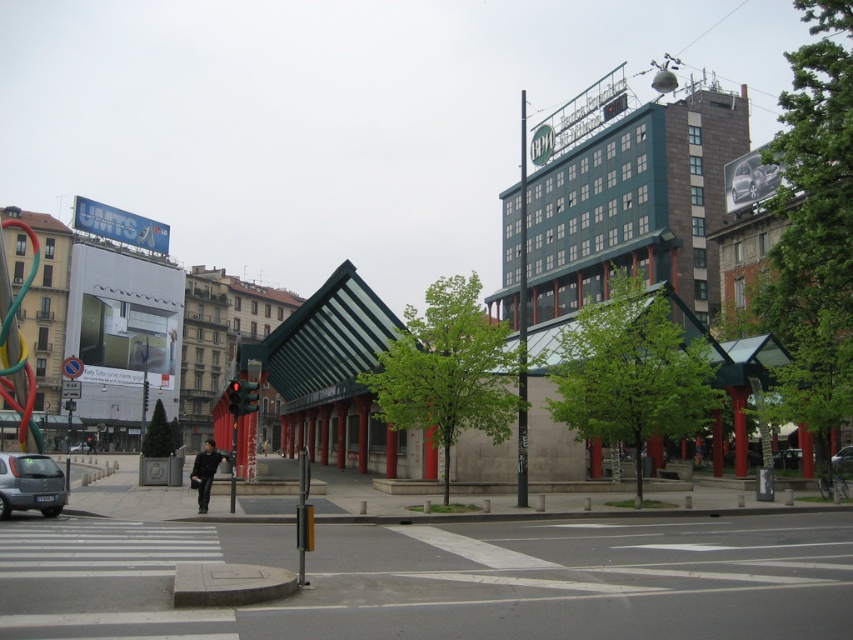
You are a pedestrian standing at the crosswalk in front of the modern building with triangular roofs. You see the white asphalt at center and the silver metallic car at lower left. Which object is located to the right side from your perspective?

The white asphalt at center is located to the right of the silver metallic car at lower left.

You are a delivery driver who needs to park your silver metallic car at lower left. The parking spot is exactly at the white asphalt at center. Can your car fit in the parking spot?

The white asphalt at center might be wider than silver metallic car at lower left, so there is a possibility that the silver metallic car at lower left can fit in the parking spot.

You are a delivery person who needs to unload a large package onto the white asphalt at center. The silver metallic car at lower left is blocking the entrance to the building. Can you move the car to access the entrance?

The white asphalt at center has a larger size compared to the silver metallic car at lower left, so the car can be moved to the white asphalt at center to allow access to the entrance.